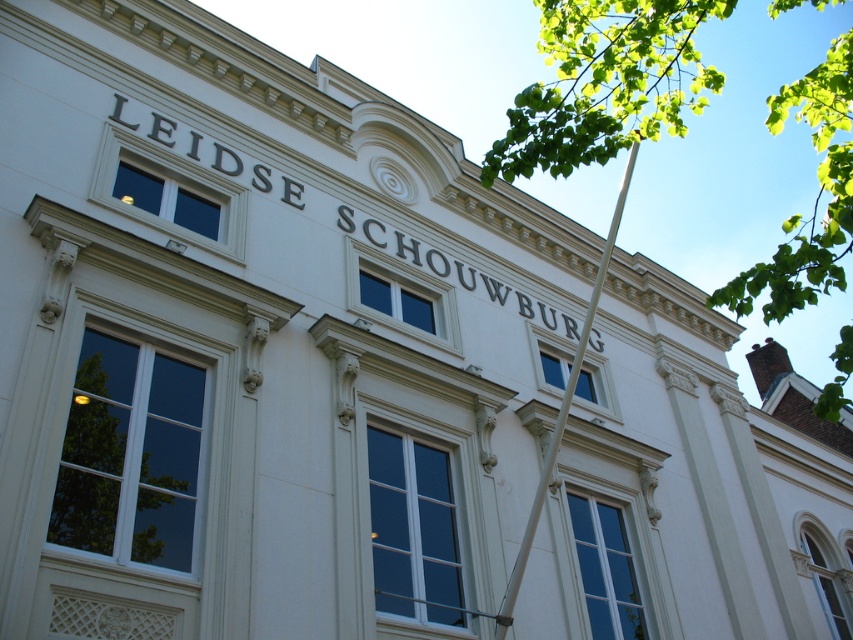
Is the position of green leafy tree at upper right less distant than that of white metallic pole at upper right?

Yes, it is.

Is green leafy tree at upper right smaller than white metallic pole at upper right?

No, green leafy tree at upper right is not smaller than white metallic pole at upper right.

Between point (821, 184) and point (589, 332), which one is positioned behind?

The point (821, 184) is behind.

Image resolution: width=853 pixels, height=640 pixels. In order to click on green leafy tree at upper right in this screenshot , I will do `click(606, 83)`.

Can you confirm if green leafy tree at upper right is shorter than green leafy tree at lower left?

No, green leafy tree at upper right is not shorter than green leafy tree at lower left.

Can you confirm if green leafy tree at upper right is taller than green leafy tree at lower left?

Indeed, green leafy tree at upper right has a greater height compared to green leafy tree at lower left.

Identify the location of green leafy tree at upper right. This screenshot has height=640, width=853. (606, 83).

Between green leafy tree at lower left and white metallic pole at upper right, which one has less height?

green leafy tree at lower left is shorter.

Can you confirm if green leafy tree at lower left is positioned above white metallic pole at upper right?

No, green leafy tree at lower left is not above white metallic pole at upper right.

Identify the location of green leafy tree at lower left. Image resolution: width=853 pixels, height=640 pixels. (131, 456).